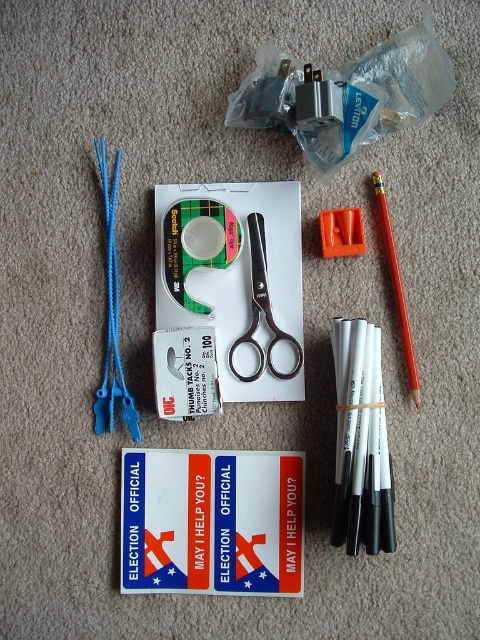
Is blue plastic ties at left further to camera compared to silver metallic scissors at center?

No, it is not.

Does blue plastic ties at left have a greater height compared to silver metallic scissors at center?

Correct, blue plastic ties at left is much taller as silver metallic scissors at center.

Between point (132, 422) and point (260, 253), which one is positioned behind?

Point (260, 253)

The width and height of the screenshot is (480, 640). Find the location of `blue plastic ties at left`. blue plastic ties at left is located at coordinates (111, 316).

Does green matte tape at center lie in front of blue plastic ties at left?

That is False.

Find the location of a particular element. green matte tape at center is located at coordinates (196, 243).

At what (x,y) coordinates should I click in order to perform the action: click on green matte tape at center. Please return your answer as a coordinate pair (x, y). Looking at the image, I should click on (196, 243).

Can you confirm if white matte pencil at right is smaller than orange plastic pencil at right?

No, white matte pencil at right is not smaller than orange plastic pencil at right.

Is point (377, 424) behind point (411, 390)?

No, (377, 424) is in front of (411, 390).

Between point (343, 417) and point (396, 285), which one is positioned in front?

Point (343, 417) is in front.

At what (x,y) coordinates should I click in order to perform the action: click on white matte pencil at right. Please return your answer as a coordinate pair (x, y). Image resolution: width=480 pixels, height=640 pixels. Looking at the image, I should click on (362, 451).